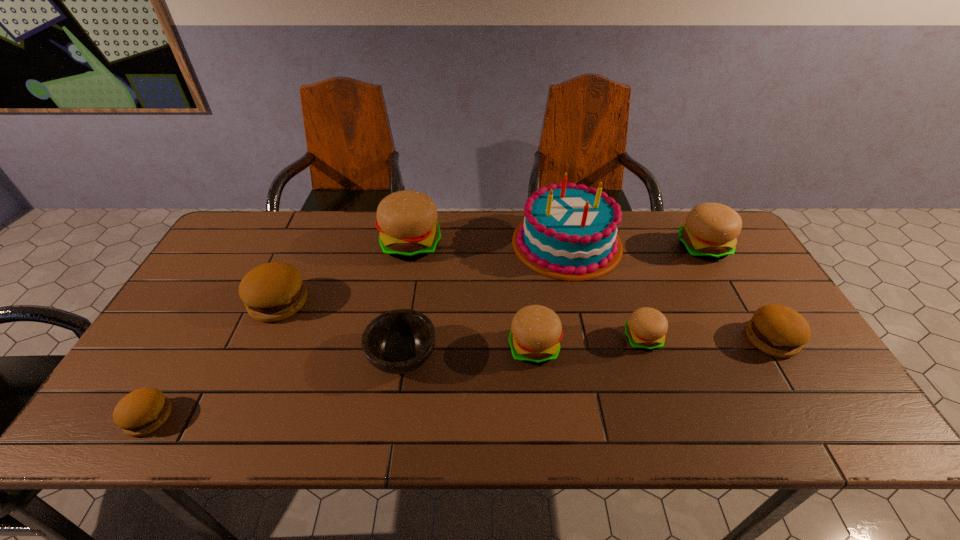
Locate an element on the screen. Image resolution: width=960 pixels, height=540 pixels. vacant space at the far edge of the desktop is located at coordinates (451, 234).

Identify the location of free spot at the near edge of the desktop. (404, 438).

The height and width of the screenshot is (540, 960). In order to click on vacant space at the left edge of the desktop in this screenshot , I will do `click(236, 281)`.

Where is `vacant area at the right edge of the desktop`? vacant area at the right edge of the desktop is located at coordinates (811, 386).

The width and height of the screenshot is (960, 540). Find the location of `vacant space at the near right corner of the desktop`. vacant space at the near right corner of the desktop is located at coordinates (828, 427).

Where is `unoccupied position between the fourth hamburger from left to right and the bowl`? The image size is (960, 540). unoccupied position between the fourth hamburger from left to right and the bowl is located at coordinates (468, 352).

This screenshot has height=540, width=960. What are the coordinates of `vacant point located between the biggest brown hamburger and the third hamburger from right to left` in the screenshot? It's located at (461, 321).

At what (x,y) coordinates should I click in order to perform the action: click on free space between the shortest object and the biggest beige hamburger. Please return your answer as a coordinate pair (x, y). Image resolution: width=960 pixels, height=540 pixels. Looking at the image, I should click on (279, 331).

Where is `vacant area between the birthday cake and the third biggest beige hamburger`? vacant area between the birthday cake and the third biggest beige hamburger is located at coordinates (550, 295).

Where is `free spot between the blue birthday cake and the second smallest brown hamburger`? free spot between the blue birthday cake and the second smallest brown hamburger is located at coordinates (669, 291).